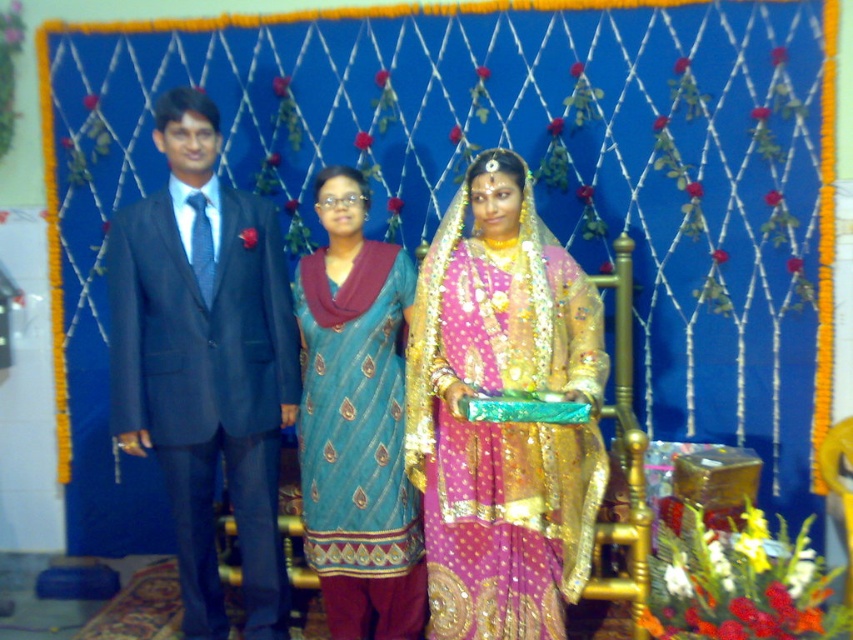
You are a photographer at a wedding. You need to position yourself so that both the shiny blue suit at left and the woman in the center are in focus. The maximum distance between two subjects for your camera to autofocus is 2.5 meters. Can you capture both in focus?

The distance between the shiny blue suit at left and the woman in the center is 2.66 meters, which exceeds the camera autofocus range of 2.5 meters. You will need to adjust your position or use a different focusing technique to ensure both are in focus.

You are a photographer at a wedding. You need to adjust the camera focus to capture both the shiny blue suit at left and the teal silk kurta at center. Given that the camera can focus on objects within a 10 inch range, will both subjects be in focus?

The distance between the shiny blue suit at left and the teal silk kurta at center is 10.32 inches. Since the camera can only focus within a 10 inch range, the two subjects are slightly out of the focus range and thus may not both be in sharp focus.

Based on the scene description, can you determine the spatial relationship between the pink satin saree at center and the shiny blue suit at left?

The pink satin saree at center is to the right of the shiny blue suit at left.